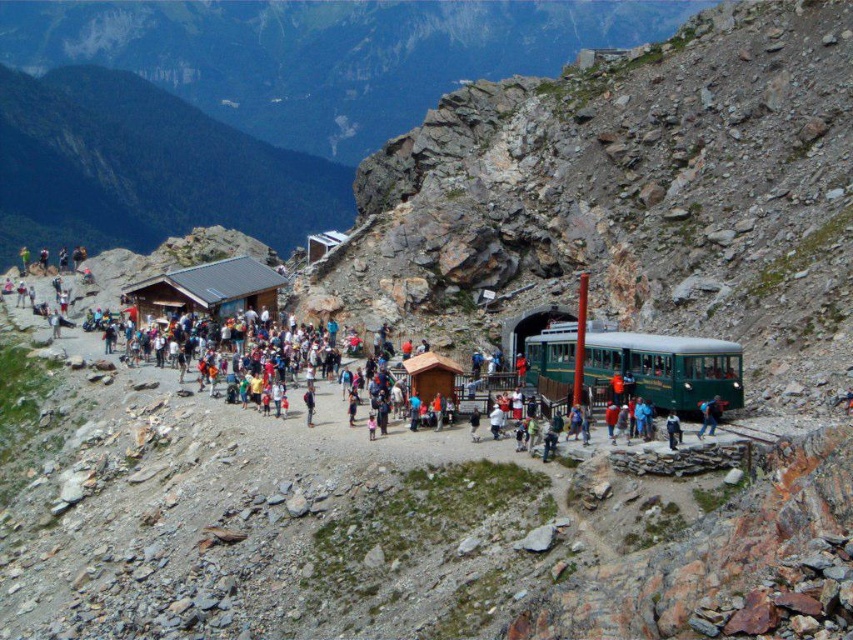
You are a photographer standing at the mountain station trying to capture a photo of both the green fabric jacket at lower right and the light blue denim jeans at center. Given that your camera has a maximum zoom range of 20 meters, will you be able to fit both subjects into the frame without moving closer?

The green fabric jacket at lower right and light blue denim jeans at center are 26.08 meters apart, which exceeds the camera maximum zoom range of 20 meters. Therefore, you will not be able to fit both subjects into the frame without moving closer.